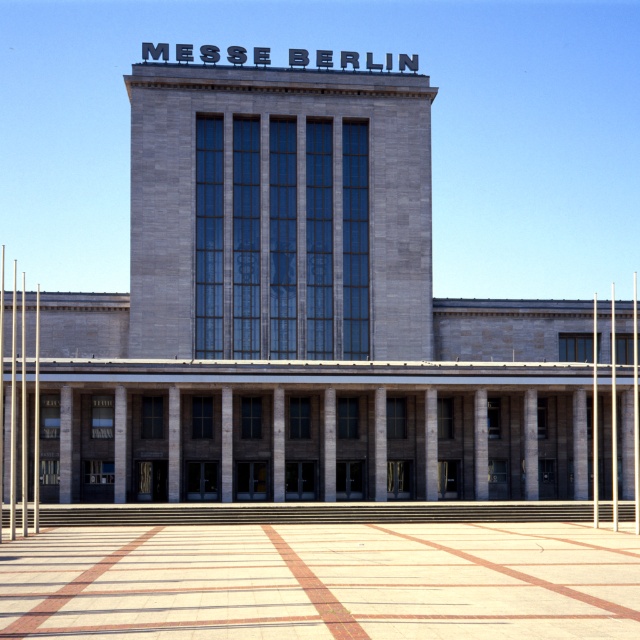
Question: Can you confirm if metallic flag pole at right is thinner than silver metallic flag pole at right?

Choices:
 (A) no
 (B) yes

Answer: (A)

Question: Among these objects, which one is nearest to the camera?

Choices:
 (A) metallic flag pole at right
 (B) silver metallic flag pole at right

Answer: (A)

Question: Considering the relative positions of metallic flag pole at right and silver metallic flag pole at right in the image provided, where is metallic flag pole at right located with respect to silver metallic flag pole at right?

Choices:
 (A) right
 (B) left

Answer: (A)

Question: Which point is closer to the camera taking this photo?

Choices:
 (A) (593, 465)
 (B) (634, 493)

Answer: (B)

Question: Can you confirm if metallic flag pole at right is wider than silver metallic flag pole at right?

Choices:
 (A) yes
 (B) no

Answer: (A)